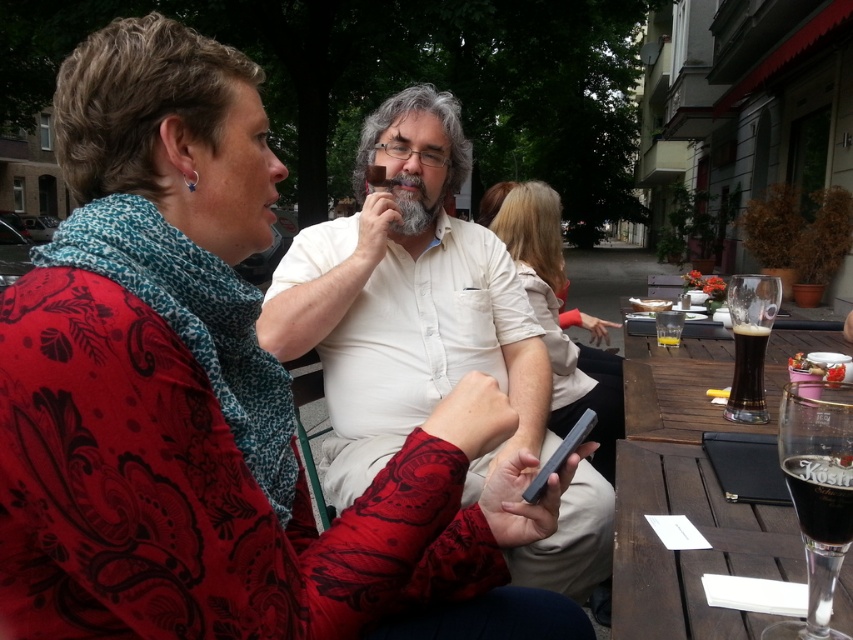
In the scene shown: You are a photographer trying to capture a candid shot of the group. The camera you are using has a focal length of 50mm and an aperture of f2.8. To ensure the matte black phone at center is in focus, where should you focus your camera?

The camera should be focused at point (215, 403) to ensure the matte black phone at center is in focus.

You are at a table with a matte black phone at center and a dark glass beer at table right. You want to grab the beer without moving the phone. Which direction should you move your hand from the phone to reach the beer?

The matte black phone at center is to the left of the dark glass beer at table right, so you should move your hand to the right from the phone to reach the beer.